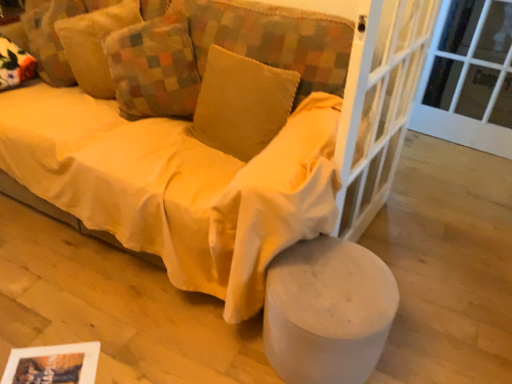
I want to click on free spot above white fabric stool at lower right (from a real-world perspective), so 325,292.